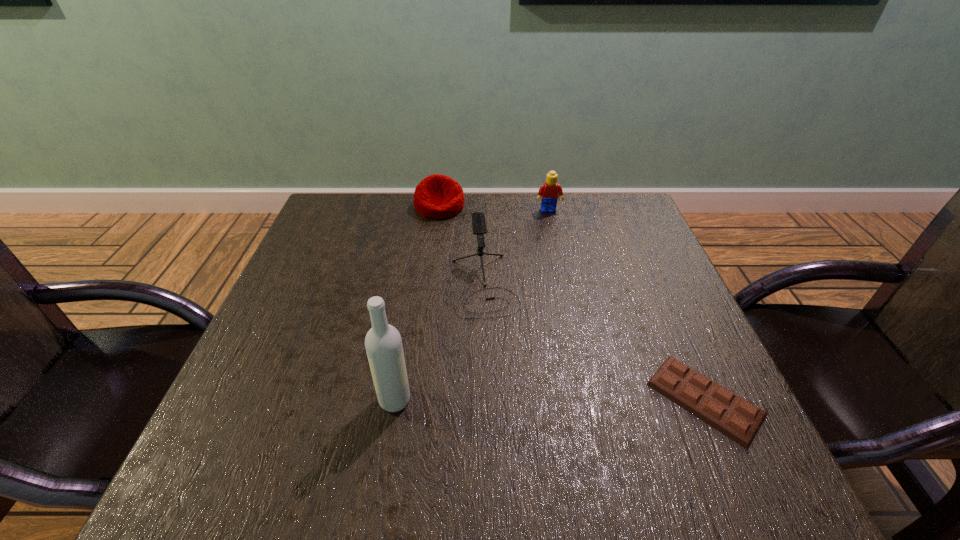
The height and width of the screenshot is (540, 960). I want to click on blank area in the image that satisfies the following two spatial constraints: 1. on the back side of the rightmost object; 2. on the left side of the vodka, so click(x=396, y=399).